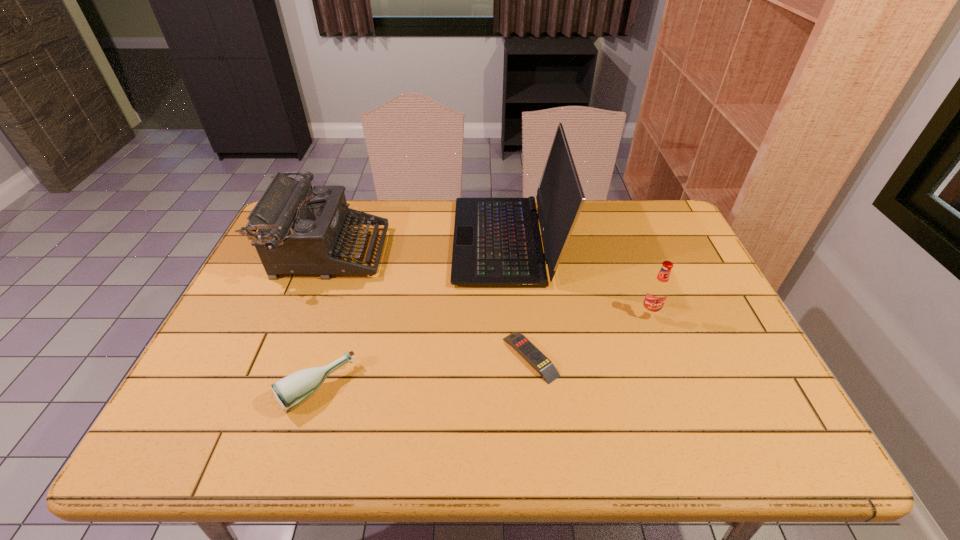
I want to click on vacant space that satisfies the following two spatial constraints: 1. on the typing side of the shortest object; 2. on the right side of the fourth shortest object, so click(x=288, y=357).

Where is `vacant space that satisfies the following two spatial constraints: 1. on the typing side of the fourth shortest object; 2. on the back side of the rightmost object`? Image resolution: width=960 pixels, height=540 pixels. vacant space that satisfies the following two spatial constraints: 1. on the typing side of the fourth shortest object; 2. on the back side of the rightmost object is located at coordinates (304, 314).

This screenshot has width=960, height=540. I want to click on vacant point that satisfies the following two spatial constraints: 1. on the typing side of the typewriter; 2. on the left side of the third shortest object, so click(x=304, y=314).

Find the location of `vacant area in the image that satisfies the following two spatial constraints: 1. on the back side of the bottle; 2. on the typing side of the second tallest object`. vacant area in the image that satisfies the following two spatial constraints: 1. on the back side of the bottle; 2. on the typing side of the second tallest object is located at coordinates (359, 252).